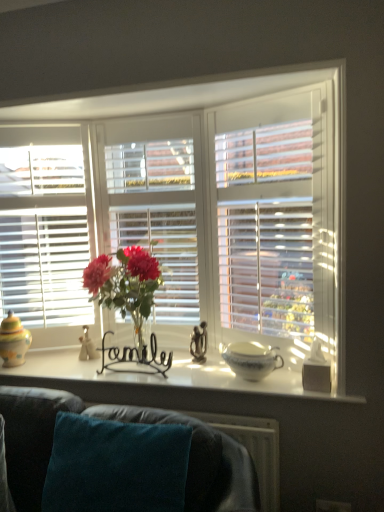
The height and width of the screenshot is (512, 384). Identify the location of free space to the left of black wire at center, positioned as the second candle holder in right-to-left order. [x=100, y=369].